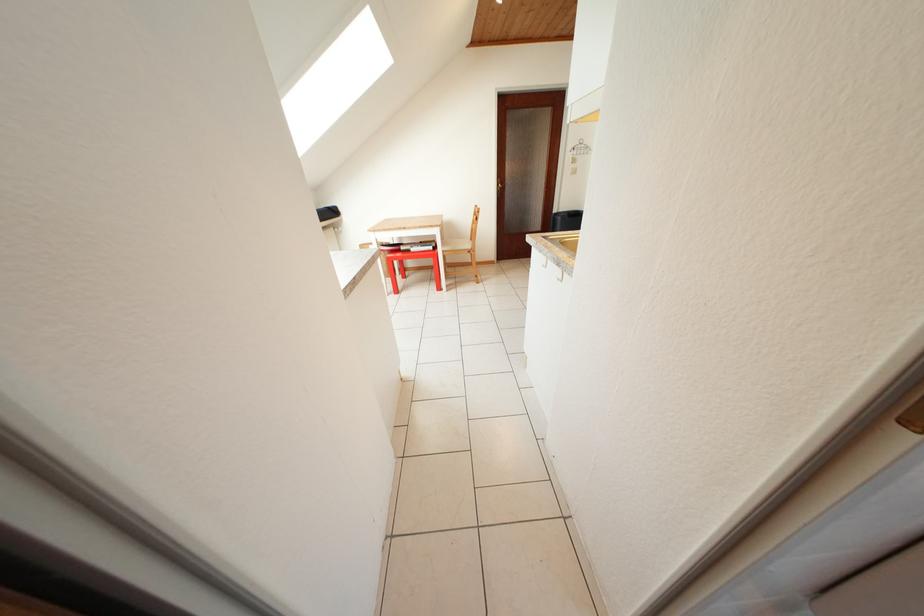
Describe the element at coordinates (580, 148) in the screenshot. I see `a white cabinet hook` at that location.